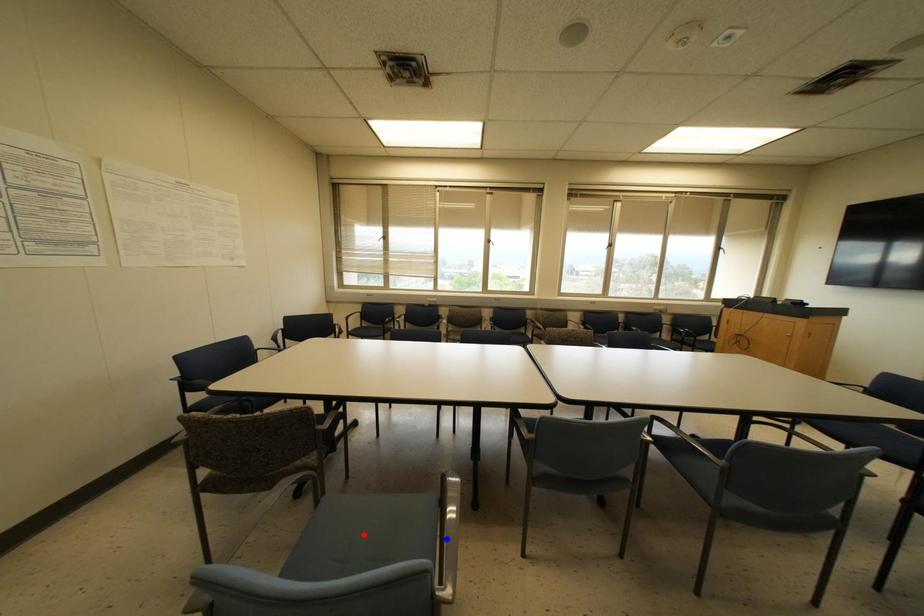
Question: Which of the two points in the image is closer to the camera?

Choices:
 (A) Blue point is closer.
 (B) Red point is closer.

Answer: (A)